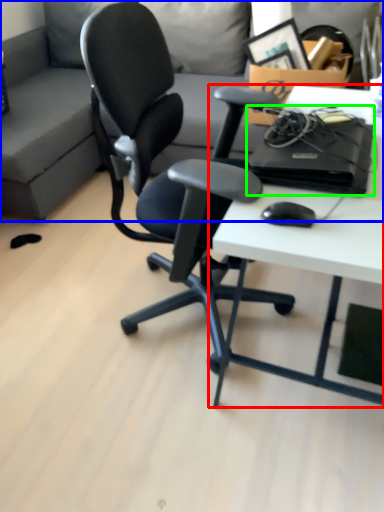
Question: Which object is positioned farthest from desk (highlighted by a red box)? Select from studio couch (highlighted by a blue box) and computer (highlighted by a green box).

Choices:
 (A) studio couch
 (B) computer

Answer: (A)